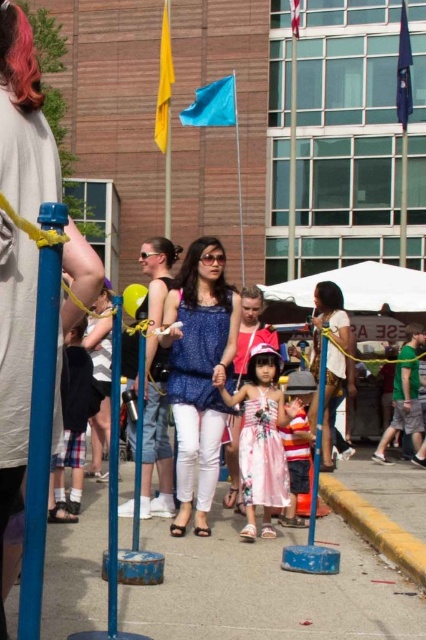
You are standing in the festival area and see the floral cotton dress at center and the blue painted metal pole at center. Which object is taller?

The blue painted metal pole at center is taller than the floral cotton dress at center.

You are a fashion designer observing a crowd at an outdoor event. You notice two blouses among the attendees. The first is a blue textured blouse at center, and the second is a matte white blouse at center. Which blouse appears taller on the person wearing it?

The blue textured blouse at center appears much taller than the matte white blouse at center.